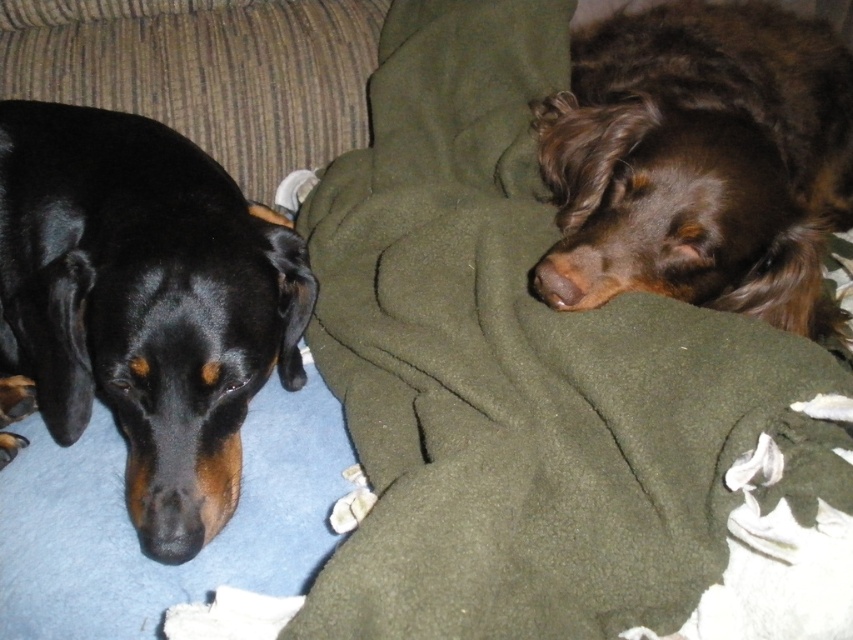
Who is lower down, black matte dog at left or brown fuzzy dog at center?

Positioned lower is black matte dog at left.

What do you see at coordinates (142, 305) in the screenshot? The image size is (853, 640). I see `black matte dog at left` at bounding box center [142, 305].

Find the location of a particular element. This screenshot has height=640, width=853. black matte dog at left is located at coordinates (142, 305).

Does green fleece blanket at upper right have a lesser width compared to black matte dog at left?

In fact, green fleece blanket at upper right might be wider than black matte dog at left.

Does point (352, 337) lie behind point (86, 388)?

Yes, point (352, 337) is farther from viewer.

At what (x,y) coordinates should I click in order to perform the action: click on green fleece blanket at upper right. Please return your answer as a coordinate pair (x, y). Looking at the image, I should click on (523, 372).

Find the location of a particular element. The width and height of the screenshot is (853, 640). green fleece blanket at upper right is located at coordinates (523, 372).

Is green fleece blanket at upper right bigger than brown fuzzy dog at center?

Yes.

Which is in front, point (469, 38) or point (759, 202)?

Positioned in front is point (759, 202).

Identify the location of green fleece blanket at upper right. (523, 372).